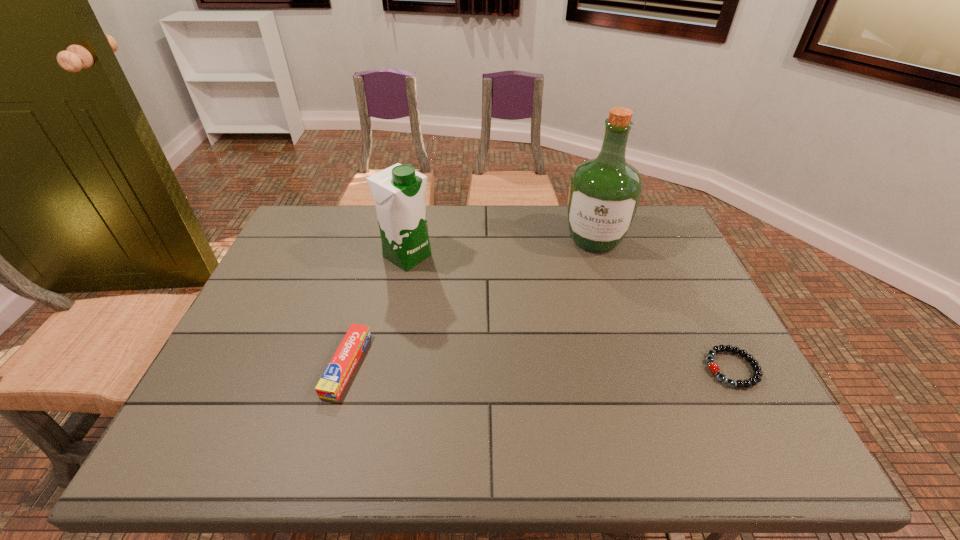
You are a GUI agent. You are given a task and a screenshot of the screen. Output one action in this format:
    pyautogui.click(x=<x>, y=<y>)
    Task: Click on the vacant area situated on the front-facing side of the third shortest object
    The image size is (960, 540).
    Given the screenshot: What is the action you would take?
    (x=482, y=302)

At what (x,y) coordinates should I click in order to perform the action: click on free space located on the front-facing side of the third object from left to right. Please return your answer as a coordinate pair (x, y). Looking at the image, I should click on (580, 336).

At what (x,y) coordinates should I click in order to perform the action: click on free space located 0.090m on the front-facing side of the third object from left to right. Please return your answer as a coordinate pair (x, y). Image resolution: width=960 pixels, height=540 pixels. Looking at the image, I should click on (588, 279).

Locate an element on the screen. free space located 0.150m on the front-facing side of the third object from left to right is located at coordinates (587, 293).

Find the location of a particular element. soya milk that is at the far edge is located at coordinates (398, 191).

Where is `liquor at the far edge`? This screenshot has height=540, width=960. liquor at the far edge is located at coordinates (604, 193).

Locate an element on the screen. toothpaste that is at the near edge is located at coordinates (333, 381).

In order to click on bracelet located at the near edge in this screenshot , I will do (x=713, y=367).

This screenshot has height=540, width=960. What are the coordinates of `bracelet that is positioned at the right edge` in the screenshot? It's located at (713, 367).

Locate an element on the screen. The image size is (960, 540). liquor that is at the right edge is located at coordinates coord(604,193).